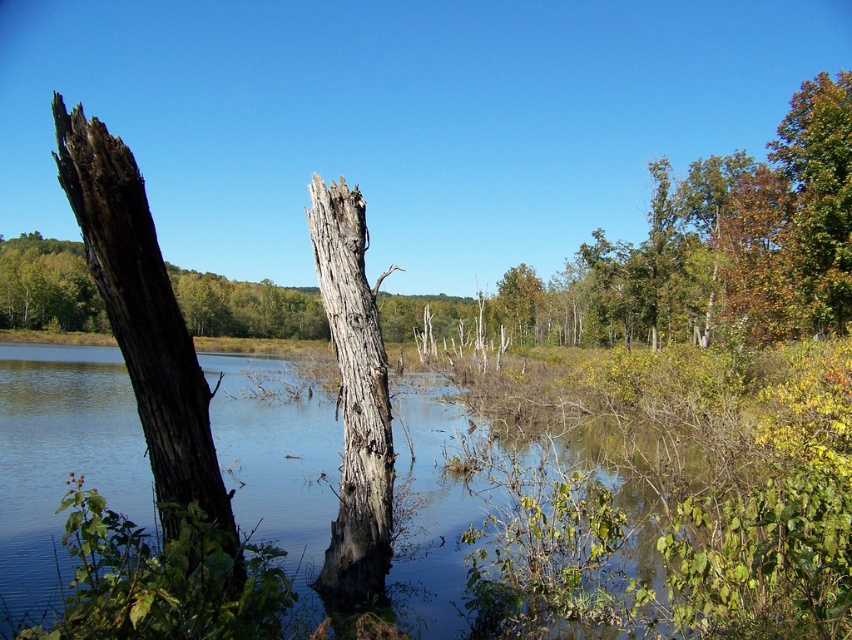
Can you confirm if clear water at center is positioned to the right of dark brown rough bark tree trunk at left?

In fact, clear water at center is to the left of dark brown rough bark tree trunk at left.

Find the location of `clear water at center`. clear water at center is located at coordinates (566, 541).

Is dark brown rough bark tree trunk at left below gray rough bark tree trunk at center?

Indeed, dark brown rough bark tree trunk at left is positioned under gray rough bark tree trunk at center.

Between dark brown rough bark tree trunk at left and gray rough bark tree trunk at center, which one appears on the left side from the viewer's perspective?

From the viewer's perspective, dark brown rough bark tree trunk at left appears more on the left side.

Describe the element at coordinates (144, 323) in the screenshot. The image size is (852, 640). I see `dark brown rough bark tree trunk at left` at that location.

Find the location of `dark brown rough bark tree trunk at left`. dark brown rough bark tree trunk at left is located at coordinates (144, 323).

Can you confirm if clear water at center is shorter than gray rough bark tree trunk at center?

Correct, clear water at center is not as tall as gray rough bark tree trunk at center.

Does clear water at center appear on the right side of gray rough bark tree trunk at center?

In fact, clear water at center is to the left of gray rough bark tree trunk at center.

Where is `clear water at center`? clear water at center is located at coordinates (566, 541).